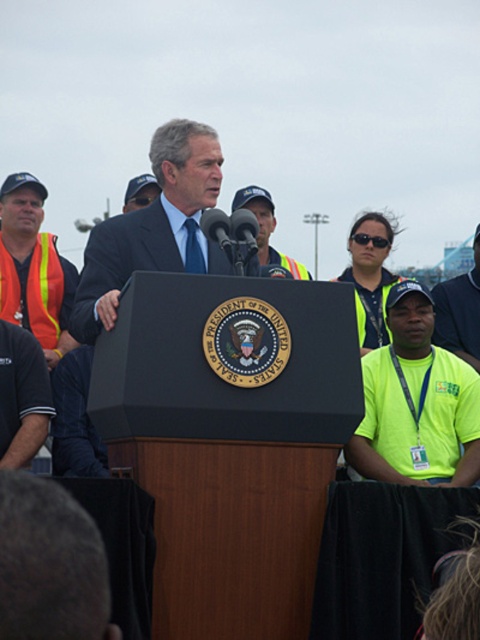
You are a photographer at the event and want to capture a closeup of the presidential seal on the podium. You are currently at the position of point [182,250]. To get a better shot, you need to move towards point [9,307]. Will moving in that direction bring you closer to the presidential seal?

Point [182,250] is closer to the camera than point [9,307]. Moving towards point [9,307] would take you farther away from the presidential seal, so it would not bring you closer.

You are attending the event and want to take a photo of the blue suit at center. Where should you position yourself to capture the best frontal view?

To capture the best frontal view of the blue suit at center, position yourself directly in front of it at point [155,227].

You are attending the event and need to locate the speaker. Which object is taller between the blue suit at center and the orange reflective safety vest at left?

The blue suit at center is taller than the orange reflective safety vest at left, so the speaker wearing the blue suit at center is taller and likely the main focus.